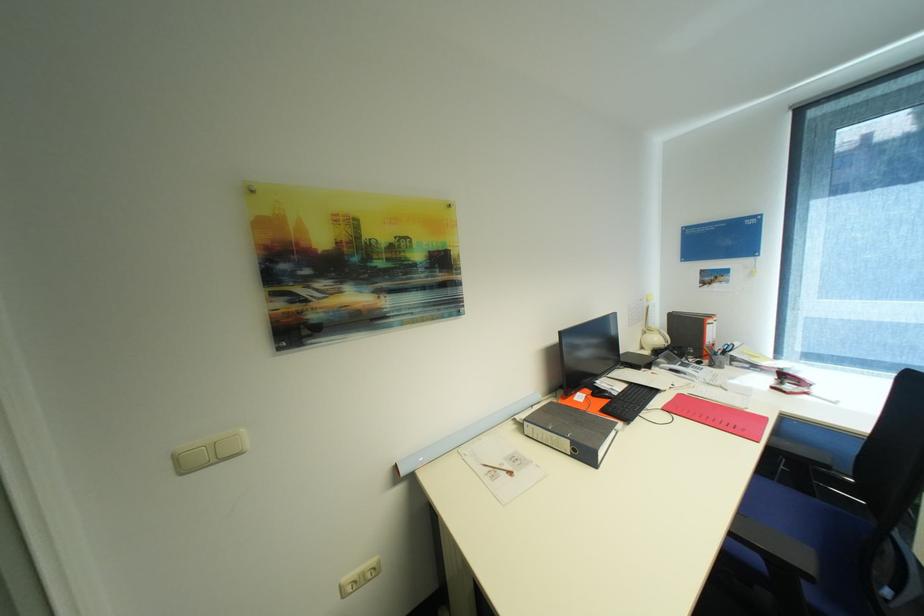
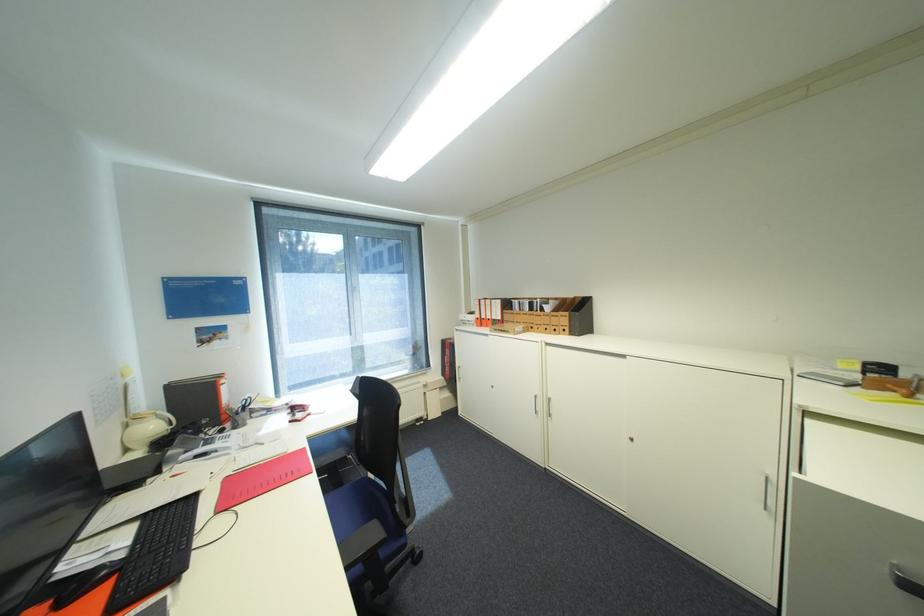
Locate, in the second image, the point that corresponds to (x=663, y=339) in the first image.

(161, 427)